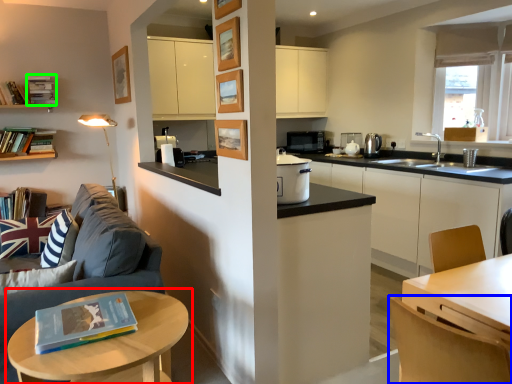
Question: Which object is the farthest from table (highlighted by a red box)? Choose among these: chair (highlighted by a blue box) or book (highlighted by a green box).

Choices:
 (A) chair
 (B) book

Answer: (B)